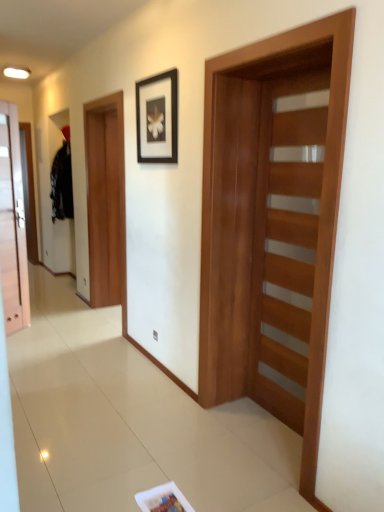
Question: Can you confirm if matte wood door at left, placed as the second door when sorted from right to left, is wider than wooden barn door at center, acting as the 1th barn door starting from the front?

Choices:
 (A) yes
 (B) no

Answer: (B)

Question: Is matte wood door at left, which is counted as the 1th door, starting from the left, positioned far away from wooden barn door at center, acting as the second barn door starting from the back?

Choices:
 (A) yes
 (B) no

Answer: (A)

Question: Can you confirm if matte wood door at left, placed as the second door when sorted from right to left, is smaller than wooden barn door at center, acting as the second barn door starting from the back?

Choices:
 (A) yes
 (B) no

Answer: (A)

Question: Is matte wood door at left, placed as the second door when sorted from right to left, to the left of wooden barn door at center, which ranks as the first barn door in right-to-left order, from the viewer's perspective?

Choices:
 (A) no
 (B) yes

Answer: (B)

Question: From the image's perspective, is matte wood door at left, which ranks as the 1th door in back-to-front order, located above wooden barn door at center, acting as the second barn door starting from the back?

Choices:
 (A) yes
 (B) no

Answer: (A)

Question: Based on their sizes in the image, would you say wooden barn door at center, which ranks as the first barn door in right-to-left order, is bigger or smaller than brown wooden door at left, the 1th barn door in the left-to-right sequence?

Choices:
 (A) big
 (B) small

Answer: (B)

Question: In terms of height, does wooden barn door at center, acting as the second barn door starting from the back, look taller or shorter compared to brown wooden door at left, arranged as the 2th barn door when viewed from the right?

Choices:
 (A) short
 (B) tall

Answer: (A)

Question: Considering their positions, is wooden barn door at center, acting as the second barn door starting from the back, located in front of or behind brown wooden door at left, which is counted as the 1th barn door, starting from the back?

Choices:
 (A) front
 (B) behind

Answer: (A)

Question: Choose the correct answer: Is wooden barn door at center, which ranks as the first barn door in right-to-left order, inside brown wooden door at left, the 1th barn door in the left-to-right sequence, or outside it?

Choices:
 (A) inside
 (B) outside

Answer: (B)

Question: Based on their sizes in the image, would you say white glossy magazine at lower center is bigger or smaller than black matte picture frame at upper center?

Choices:
 (A) big
 (B) small

Answer: (B)

Question: Considering the positions of white glossy magazine at lower center and black matte picture frame at upper center in the image, is white glossy magazine at lower center taller or shorter than black matte picture frame at upper center?

Choices:
 (A) short
 (B) tall

Answer: (A)

Question: From the image's perspective, is white glossy magazine at lower center positioned above or below black matte picture frame at upper center?

Choices:
 (A) above
 (B) below

Answer: (B)

Question: In the image, is white glossy magazine at lower center on the left side or the right side of black matte picture frame at upper center?

Choices:
 (A) left
 (B) right

Answer: (B)

Question: Looking at the image, does white glossy magazine at lower center seem bigger or smaller compared to brown wooden door at left, arranged as the 2th barn door when viewed from the right?

Choices:
 (A) small
 (B) big

Answer: (A)

Question: In the image, is white glossy magazine at lower center positioned in front of or behind brown wooden door at left, the 1th barn door in the left-to-right sequence?

Choices:
 (A) behind
 (B) front

Answer: (B)